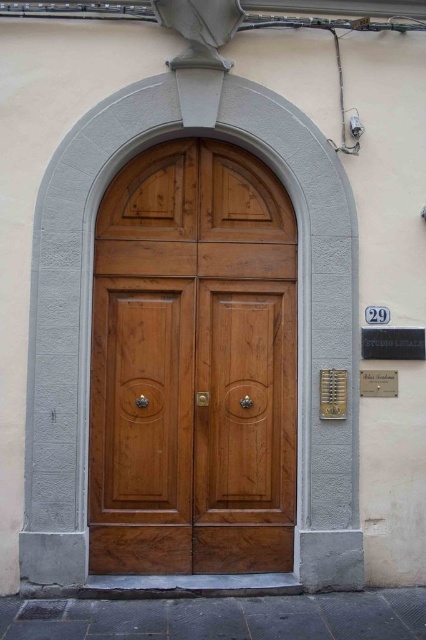
You are standing in front of the building and need to locate the entrance. You see the walnut wood door at center and the black metal plaque at center right. Which object is positioned to the left of the other?

The walnut wood door at center is to the left of black metal plaque at center right.

You are a visitor approaching the building and see the black metal plaque at center right and the metallic gold plaque at right. Which plaque do you need to press to activate the intercom?

The black metal plaque at center right is closer to you, so you should press the black metal plaque at center right to activate the intercom.

You are standing in front of the building and want to press the intercom system. The intercom has two points labeled on its panel. Which point is closer to you, point 1 at coordinates (195, 483) or point 2 at coordinates (388, 332)?

Point 2 at coordinates (388, 332) is closer to you because point 1 at coordinates (195, 483) is behind it according to the spatial arrangement.